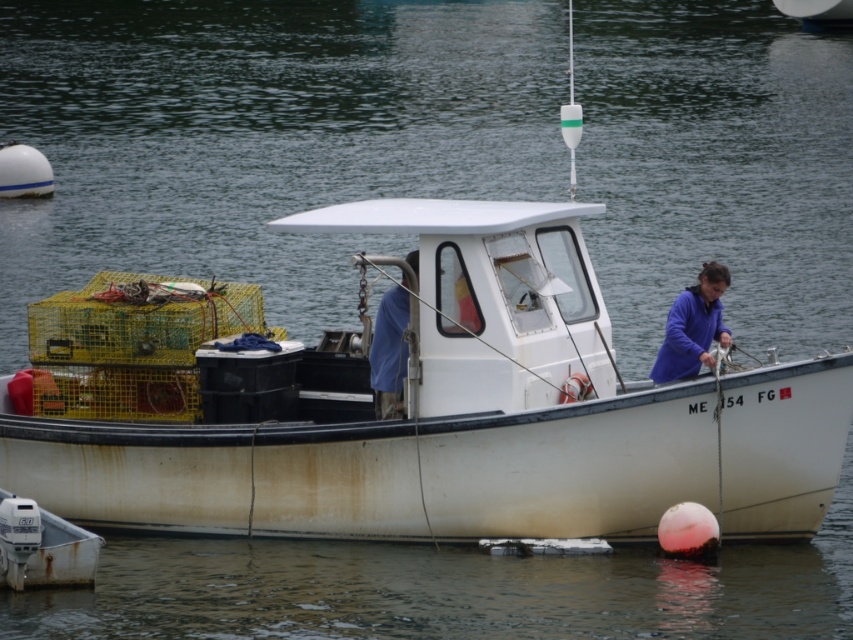
Is point (666, 355) closer to viewer compared to point (370, 372)?

No, it is not.

Find the location of a particular element. The width and height of the screenshot is (853, 640). purple matte jacket at center is located at coordinates (693, 326).

Where is `purple matte jacket at center`? This screenshot has height=640, width=853. purple matte jacket at center is located at coordinates (693, 326).